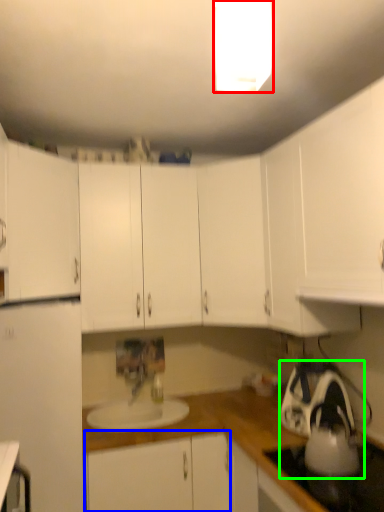
Question: Which object is the farthest from light fixture (highlighted by a red box)? Choose among these: cabinetry (highlighted by a blue box) or appliance (highlighted by a green box).

Choices:
 (A) cabinetry
 (B) appliance

Answer: (A)